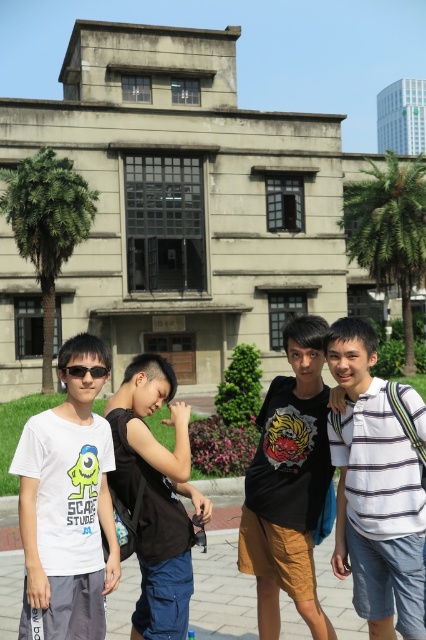
Is white matte t-shirt at left below gray concrete pavement at lower center?

Actually, white matte t-shirt at left is above gray concrete pavement at lower center.

Who is shorter, white matte t-shirt at left or gray concrete pavement at lower center?

gray concrete pavement at lower center

Between point (34, 518) and point (0, 598), which one is positioned in front?

Point (34, 518) is in front.

Locate an element on the screen. The width and height of the screenshot is (426, 640). white matte t-shirt at left is located at coordinates (66, 506).

Is black matte t-shirt at center closer to the viewer compared to black cotton tank top at center?

No.

Between point (311, 368) and point (163, 460), which one is positioned behind?

The point (311, 368) is more distant.

In order to click on black matte t-shirt at center in this screenshot , I will do `click(288, 484)`.

Who is more distant from viewer, [170,513] or [108,602]?

The point [108,602] is behind.

Can you confirm if black cotton tank top at center is positioned above gray concrete pavement at lower center?

Indeed, black cotton tank top at center is positioned over gray concrete pavement at lower center.

Where is `black cotton tank top at center`? The image size is (426, 640). black cotton tank top at center is located at coordinates (155, 496).

Where is `black cotton tank top at center`? black cotton tank top at center is located at coordinates (155, 496).